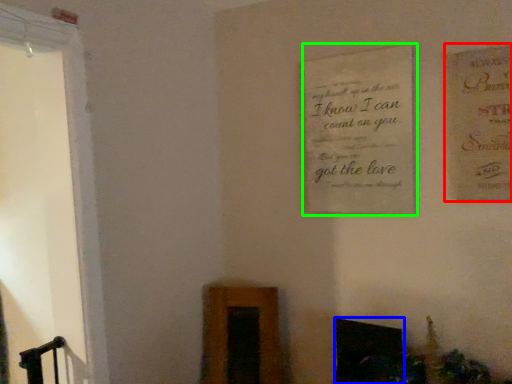
Question: Which object is positioned farthest from postcard (highlighted by a red box)? Select from fireplace (highlighted by a blue box) and plaque (highlighted by a green box).

Choices:
 (A) fireplace
 (B) plaque

Answer: (A)